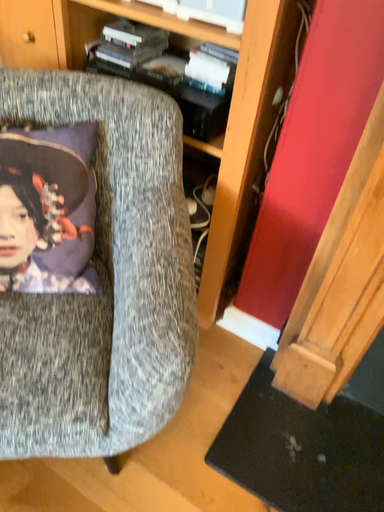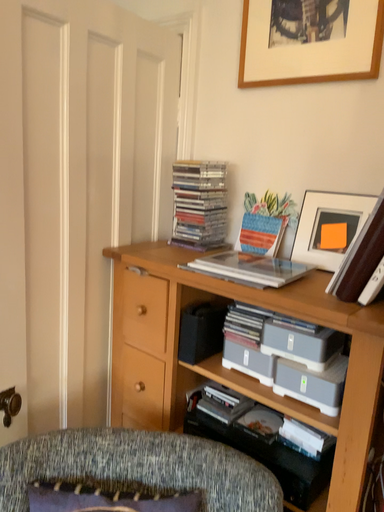
Question: How did the camera likely rotate when shooting the video?

Choices:
 (A) rotated right
 (B) rotated left

Answer: (B)